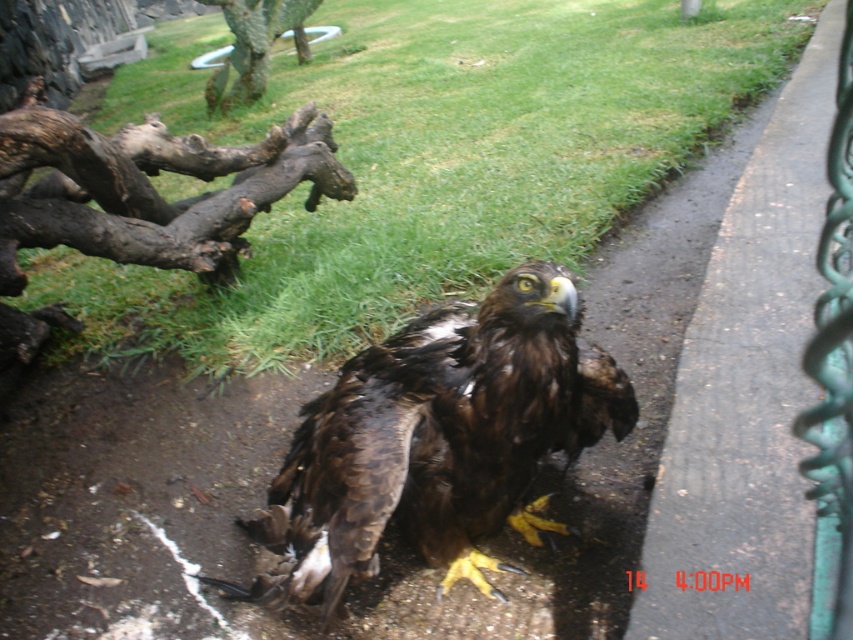
You are standing on the paved pathway where the golden eagle is perched. Looking towards the green grass at upper center, can you determine its position relative to the eagle?

The green grass at upper center is located at point coordinates approximately 0.253 on the x and 0.498 on the y axis, so it is positioned to the upper center relative to the eagle on the pathway.

You are a small animal trying to hide from the golden eagle. You can choose to hide behind either the green grass at upper center or the green textured fence at right. Which option would provide better concealment based on their sizes?

The green grass at upper center has a greater height compared to the green textured fence at right, so hiding behind the green grass at upper center would provide better concealment since it is taller than the fence.

Based on the photo, you are a park visitor who wants to take a photo of the brown feathered eagle at center and the green textured fence at right. If you stand in the middle of the pathway, which direction should you face to ensure both objects are in your camera frame?

You should face towards the right because the brown feathered eagle at center is to the left of the green textured fence at right, so facing right will keep both in view.